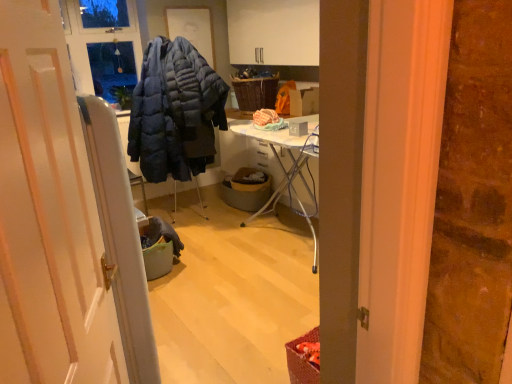
Question: In terms of height, does woven brown picnic basket at center look taller or shorter compared to brown woven basket at center?

Choices:
 (A) short
 (B) tall

Answer: (B)

Question: Is woven brown picnic basket at center bigger or smaller than brown woven basket at center?

Choices:
 (A) big
 (B) small

Answer: (A)

Question: Estimate the real-world distances between objects in this image. Which object is farther from the brown woven basket at center?

Choices:
 (A) woven brown picnic basket at center
 (B) white glossy door at center

Answer: (B)

Question: Which object is positioned closest to the white glossy door at center?

Choices:
 (A) brown woven basket at center
 (B) woven brown picnic basket at center

Answer: (A)